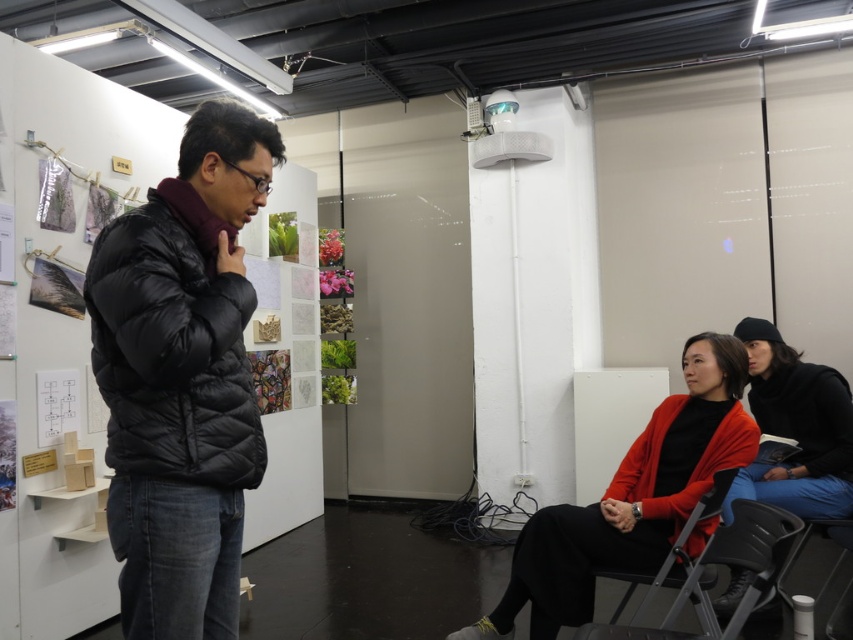
Is black puffer jacket at center behind matte black sweater at lower right?

No, black puffer jacket at center is closer to the viewer.

Can you confirm if black puffer jacket at center is bigger than matte black sweater at lower right?

No.

Is point (231, 512) less distant than point (766, 326)?

Yes, it is in front of point (766, 326).

The width and height of the screenshot is (853, 640). I want to click on black puffer jacket at center, so click(183, 378).

Which of these two, black puffer jacket at center or black plastic chair at lower center, stands shorter?

With less height is black plastic chair at lower center.

Does black puffer jacket at center appear over black plastic chair at lower center?

Yes, black puffer jacket at center is above black plastic chair at lower center.

This screenshot has width=853, height=640. What do you see at coordinates (183, 378) in the screenshot?
I see `black puffer jacket at center` at bounding box center [183, 378].

What are the coordinates of `black puffer jacket at center` in the screenshot? It's located at (183, 378).

Is matte red sweater at lower right bigger than matte black sweater at lower right?

Yes, matte red sweater at lower right is bigger than matte black sweater at lower right.

Is point (531, 545) more distant than point (737, 588)?

No, (531, 545) is in front of (737, 588).

In order to click on matte red sweater at lower right in this screenshot , I will do `click(631, 499)`.